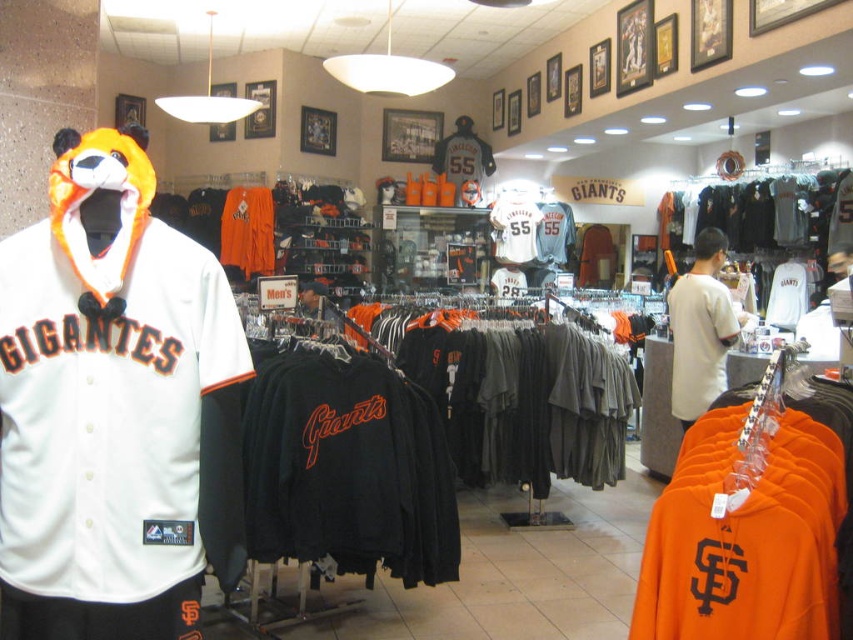
You are a customer in the sports store looking to buy a Giants jersey. You want to choose the jersey that is bigger in size. Which one should you pick between the black jersey at center and the orange jersey at center?

The black jersey at center has a larger size compared to the orange jersey at center, so you should pick the black jersey at center.